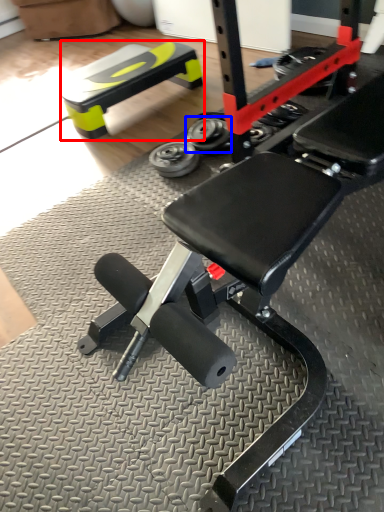
Question: Which object appears farthest to the camera in this image, bench (highlighted by a red box) or wheel (highlighted by a blue box)?

Choices:
 (A) bench
 (B) wheel

Answer: (A)